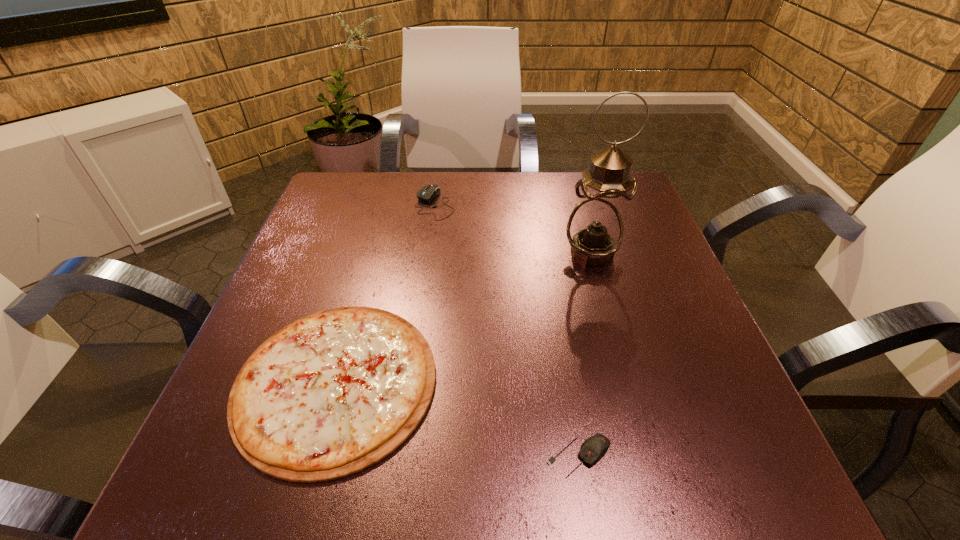
Where is `vacant space situated on the back of the pizza`? The image size is (960, 540). vacant space situated on the back of the pizza is located at coordinates (373, 247).

Image resolution: width=960 pixels, height=540 pixels. Find the location of `object that is at the far edge`. object that is at the far edge is located at coordinates (427, 193).

At what (x,y) coordinates should I click in order to perform the action: click on mouse located in the near edge section of the desktop. Please return your answer as a coordinate pair (x, y). The width and height of the screenshot is (960, 540). Looking at the image, I should click on (595, 447).

Find the location of `pizza that is at the near edge`. pizza that is at the near edge is located at coordinates (333, 393).

You are a GUI agent. You are given a task and a screenshot of the screen. Output one action in this format:
    pyautogui.click(x=<x>, y=<y>)
    Task: Click on the object that is at the left edge
    
    Given the screenshot: What is the action you would take?
    pyautogui.click(x=333, y=393)

Identify the location of object located at the right edge. (595, 229).

Identify the location of object located at the near left corner. The image size is (960, 540). (333, 393).

In the image, there is a desktop. At what (x,y) coordinates should I click in order to perform the action: click on vacant space at the far edge. Please return your answer as a coordinate pair (x, y). Looking at the image, I should click on (462, 216).

In the image, there is a desktop. Find the location of `vacant space at the near edge`. vacant space at the near edge is located at coordinates (464, 472).

Locate an element on the screen. This screenshot has height=540, width=960. vacant space at the left edge of the desktop is located at coordinates (347, 226).